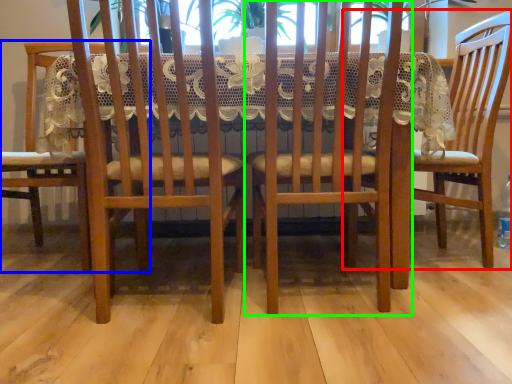
Question: Estimate the real-world distances between objects in this image. Which object is closer to chair (highlighted by a red box), chair (highlighted by a blue box) or chair (highlighted by a green box)?

Choices:
 (A) chair
 (B) chair

Answer: (B)